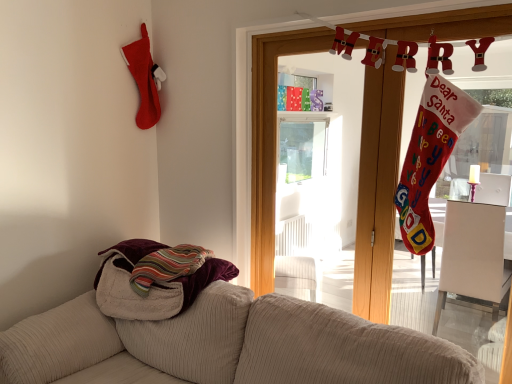
You are a GUI agent. You are given a task and a screenshot of the screen. Output one action in this format:
    pyautogui.click(x=<x>, y=<y>)
    Task: Click on the beige corduroy couch at lower left
    Image resolution: width=512 pixels, height=384 pixels.
    Given the screenshot: What is the action you would take?
    pyautogui.click(x=233, y=345)

At what (x,y) coordinates should I click in order to perform the action: click on striped cotton towel at lower left. Please return your answer as a coordinate pair (x, y). Image resolution: width=512 pixels, height=384 pixels. Looking at the image, I should click on (155, 279).

Where is `beige corduroy couch at lower left`? beige corduroy couch at lower left is located at coordinates (233, 345).

Is beige corduroy couch at lower left next to wooden door at upper center?

beige corduroy couch at lower left and wooden door at upper center are clearly separated.

Does beige corduroy couch at lower left have a greater width compared to wooden door at upper center?

Correct, the width of beige corduroy couch at lower left exceeds that of wooden door at upper center.

From the image's perspective, which one is positioned higher, beige corduroy couch at lower left or wooden door at upper center?

wooden door at upper center is shown above in the image.

Find the location of a particular element. studio couch below the wooden door at upper center (from a real-world perspective) is located at coordinates (233, 345).

In terms of size, does beige corduroy couch at lower left appear bigger or smaller than striped cotton towel at lower left?

In the image, beige corduroy couch at lower left appears to be larger than striped cotton towel at lower left.

From a real-world perspective, between beige corduroy couch at lower left and striped cotton towel at lower left, who is vertically lower?

From a 3D spatial view, beige corduroy couch at lower left is below.

Is beige corduroy couch at lower left not within striped cotton towel at lower left?

Indeed, beige corduroy couch at lower left is completely outside striped cotton towel at lower left.

Does beige corduroy couch at lower left have a greater height compared to striped cotton towel at lower left?

Indeed, beige corduroy couch at lower left has a greater height compared to striped cotton towel at lower left.

From a real-world perspective, is striped cotton towel at lower left above or below beige corduroy couch at lower left?

In terms of real-world spatial position, striped cotton towel at lower left is above beige corduroy couch at lower left.

Measure the distance between striped cotton towel at lower left and beige corduroy couch at lower left.

striped cotton towel at lower left is 10.21 inches from beige corduroy couch at lower left.

Is beige corduroy couch at lower left a part of striped cotton towel at lower left?

No, beige corduroy couch at lower left is located outside of striped cotton towel at lower left.

From the picture: Considering the sizes of striped cotton towel at lower left and beige corduroy couch at lower left in the image, is striped cotton towel at lower left bigger or smaller than beige corduroy couch at lower left?

Clearly, striped cotton towel at lower left is smaller in size than beige corduroy couch at lower left.

Is wooden door at upper center next to beige corduroy couch at lower left and touching it?

No, wooden door at upper center is not next to beige corduroy couch at lower left.

Does wooden door at upper center have a lesser height compared to beige corduroy couch at lower left?

In fact, wooden door at upper center may be taller than beige corduroy couch at lower left.

Where is `window frame that is above the beige corduroy couch at lower left (from a real-world perspective)`? The width and height of the screenshot is (512, 384). window frame that is above the beige corduroy couch at lower left (from a real-world perspective) is located at coordinates (377, 190).

From a real-world perspective, who is located higher, wooden door at upper center or beige corduroy couch at lower left?

wooden door at upper center is physically above.

You are a GUI agent. You are given a task and a screenshot of the screen. Output one action in this format:
    pyautogui.click(x=<x>, y=<y>)
    Task: Click on the window frame in front of the striped cotton towel at lower left
    The image size is (512, 384).
    Given the screenshot: What is the action you would take?
    pyautogui.click(x=377, y=190)

Would you consider wooden door at upper center to be distant from striped cotton towel at lower left?

No, wooden door at upper center is not far away from striped cotton towel at lower left.

Does point (255, 287) lie in front of point (106, 285)?

No.

Is wooden door at upper center to the left of striped cotton towel at lower left from the viewer's perspective?

No, wooden door at upper center is not to the left of striped cotton towel at lower left.

Between striped cotton towel at lower left and wooden door at upper center, which one has more height?

Standing taller between the two is wooden door at upper center.

The image size is (512, 384). Find the location of `window frame above the striped cotton towel at lower left (from a real-world perspective)`. window frame above the striped cotton towel at lower left (from a real-world perspective) is located at coordinates (377, 190).

Considering the relative sizes of striped cotton towel at lower left and wooden door at upper center in the image provided, is striped cotton towel at lower left thinner than wooden door at upper center?

Incorrect, the width of striped cotton towel at lower left is not less than that of wooden door at upper center.

Can we say striped cotton towel at lower left lies outside wooden door at upper center?

striped cotton towel at lower left is positioned outside wooden door at upper center.

The width and height of the screenshot is (512, 384). I want to click on window frame lying on the right of beige corduroy couch at lower left, so click(x=377, y=190).

Where is `studio couch below the striped cotton towel at lower left (from the image's perspective)`? The height and width of the screenshot is (384, 512). studio couch below the striped cotton towel at lower left (from the image's perspective) is located at coordinates (233, 345).

Looking at the image, which one is located further to striped cotton towel at lower left, beige corduroy couch at lower left or wooden door at upper center?

Based on the image, wooden door at upper center appears to be further to striped cotton towel at lower left.

From the image, which object appears to be farther from beige corduroy couch at lower left, wooden door at upper center or striped cotton towel at lower left?

Among the two, wooden door at upper center is located further to beige corduroy couch at lower left.

Estimate the real-world distances between objects in this image. Which object is closer to wooden door at upper center, striped cotton towel at lower left or beige corduroy couch at lower left?

striped cotton towel at lower left.

Estimate the real-world distances between objects in this image. Which object is closer to striped cotton towel at lower left, wooden door at upper center or beige corduroy couch at lower left?

Among the two, beige corduroy couch at lower left is located nearer to striped cotton towel at lower left.

Based on their spatial positions, is beige corduroy couch at lower left or striped cotton towel at lower left closer to wooden door at upper center?

striped cotton towel at lower left.

Considering their positions, is striped cotton towel at lower left positioned closer to beige corduroy couch at lower left than wooden door at upper center?

striped cotton towel at lower left is positioned closer to the anchor beige corduroy couch at lower left.

This screenshot has width=512, height=384. In order to click on window frame located between beige corduroy couch at lower left and striped cotton towel at lower left in the depth direction in this screenshot , I will do `click(377, 190)`.